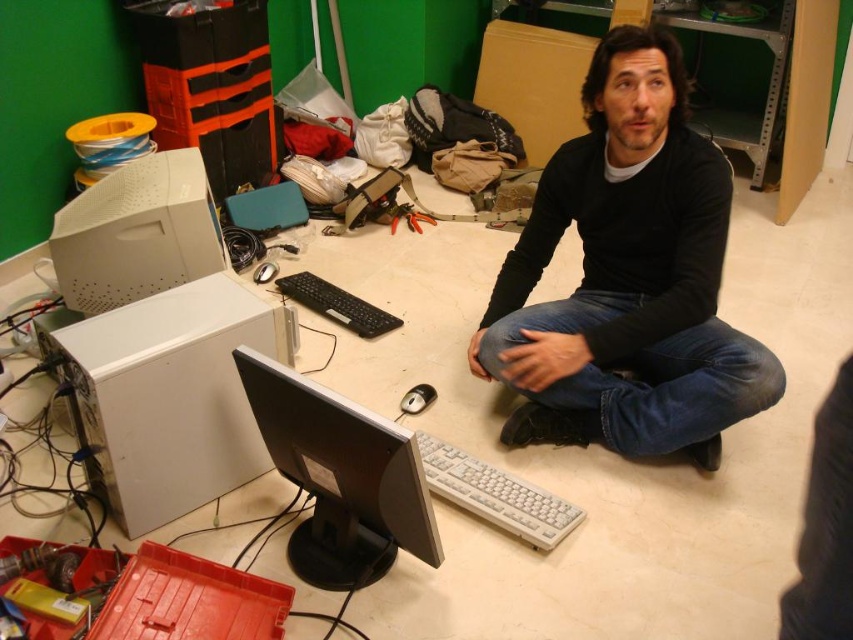
Question: Which point is closer to the camera?

Choices:
 (A) (473, 465)
 (B) (325, 292)
 (C) (125, 362)

Answer: (C)

Question: Can you confirm if black matte shirt at center is smaller than white plastic keyboard at lower center?

Choices:
 (A) no
 (B) yes

Answer: (A)

Question: Does white plastic desktop computer at left appear under black plastic keyboard at center?

Choices:
 (A) no
 (B) yes

Answer: (A)

Question: Is black matte shirt at center smaller than white plastic keyboard at lower center?

Choices:
 (A) no
 (B) yes

Answer: (A)

Question: Estimate the real-world distances between objects in this image. Which object is farther from the white plastic keyboard at lower center?

Choices:
 (A) satin black monitor at center
 (B) white plastic computer case at lower left

Answer: (B)

Question: Which point appears closest to the camera in this image?

Choices:
 (A) (544, 387)
 (B) (426, 460)

Answer: (B)